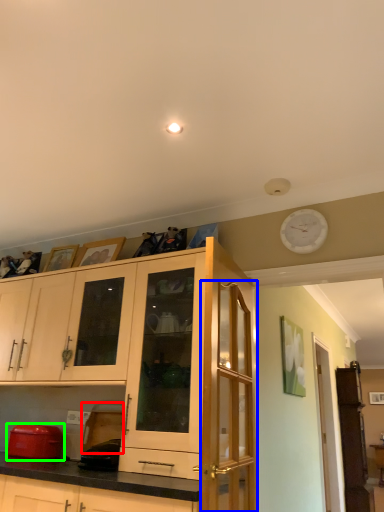
Question: Which is farther away from appliance (highlighted by a red box)? glass door (highlighted by a blue box) or appliance (highlighted by a green box)?

Choices:
 (A) glass door
 (B) appliance

Answer: (A)